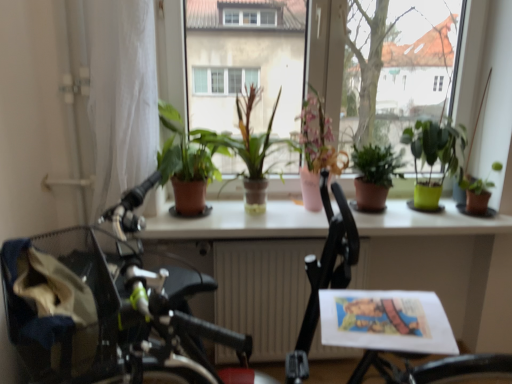
At what (x,y) coordinates should I click in order to perform the action: click on free space in front of green plastic pot at right, the fifth houseplant positioned from the left. Please return your answer as a coordinate pair (x, y). Looking at the image, I should click on (440, 217).